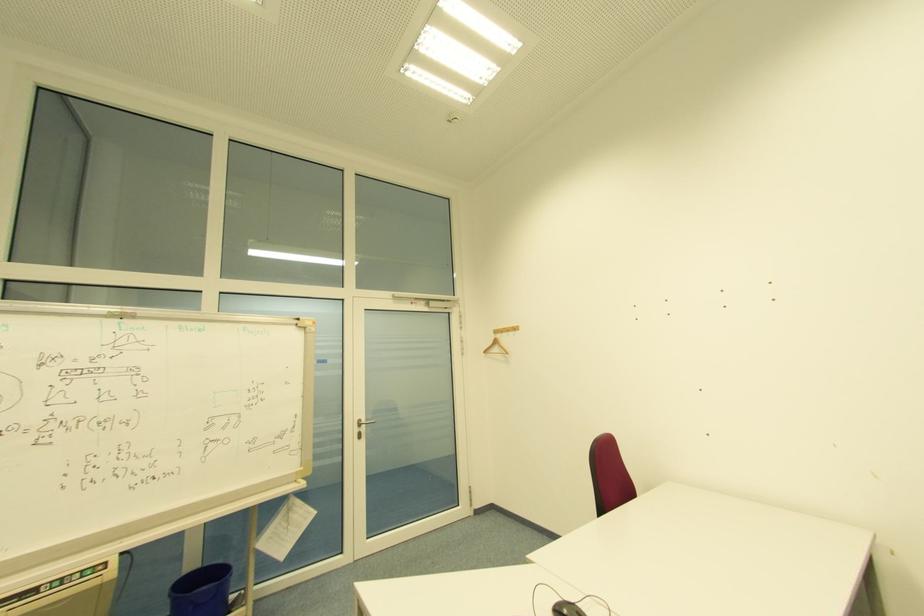
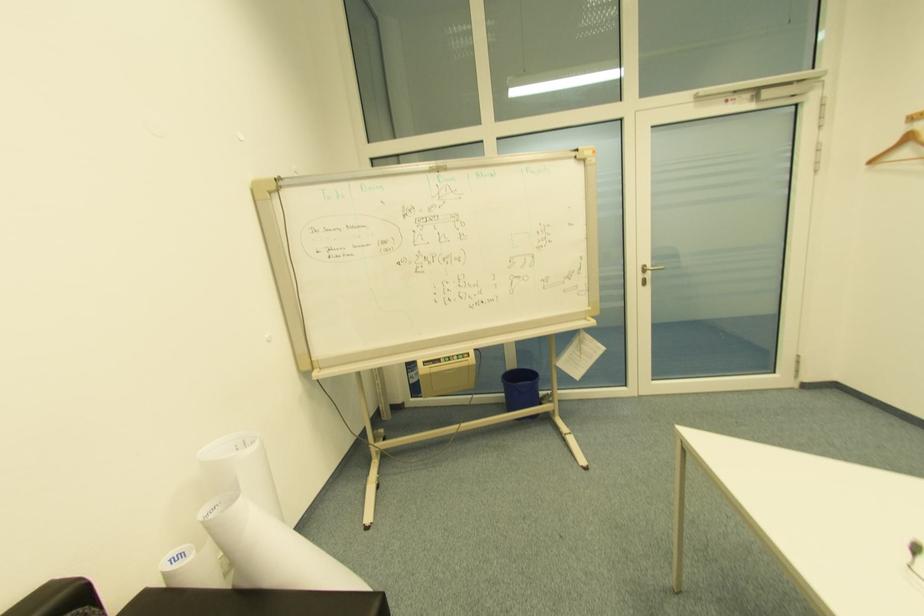
How did the camera likely rotate?

The camera's rotation is toward left-down.